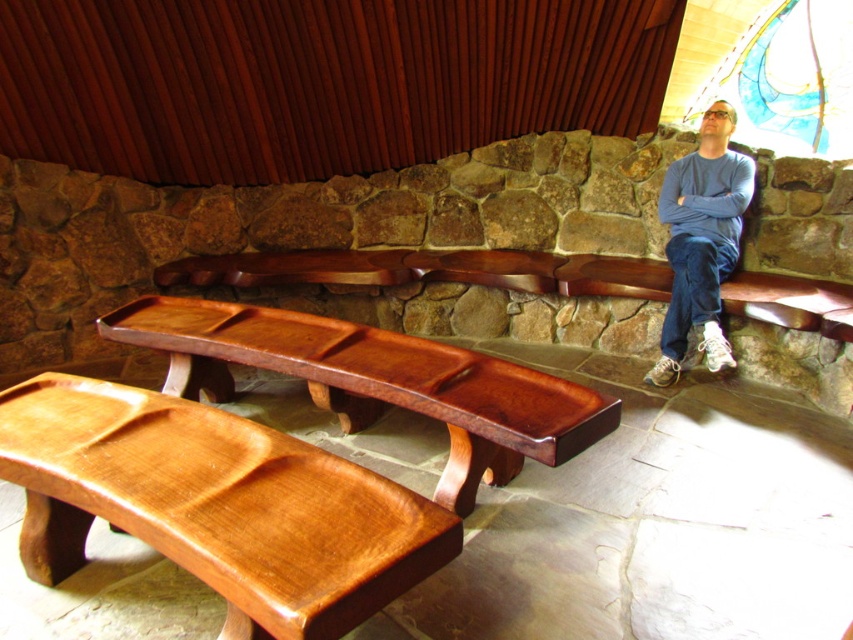
You are a painter standing at the entrance of the room. You need to place a 1.2 meter tall painting on the wall between the shiny brown wood bench at lower left and the satin wood bench at center. Which bench will the painting block more of the view from the entrance?

The painting placed between the shiny brown wood bench at lower left and the satin wood bench at center will block more of the view from the entrance when placed closer to the taller satin wood bench at center, since it is taller than the shiny brown wood bench at lower left.

You are organizing a small event in this space and need to place a decorative vase on the satin wood bench at center. However, there is a blue cotton shirt at right hanging nearby. Since the bench is under the shirt, will the vase placed on the bench be visible from the front?

The satin wood bench at center is positioned under the blue cotton shirt at right, so the shirt may block the view of the vase placed on the bench from the front. Check the shirt position before placing the vase.